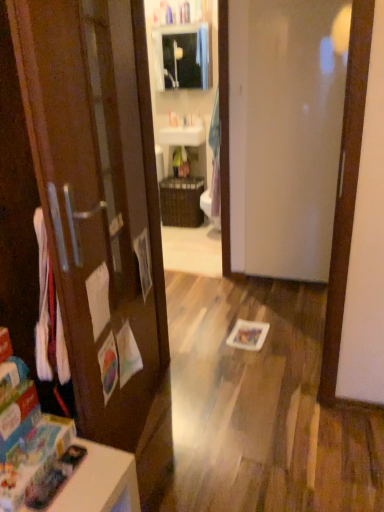
Question: From the image's perspective, is white glossy table at lower left on top of white glossy door at center?

Choices:
 (A) yes
 (B) no

Answer: (B)

Question: From a real-world perspective, does white glossy table at lower left sit lower than white glossy door at center?

Choices:
 (A) no
 (B) yes

Answer: (B)

Question: Does white glossy table at lower left appear on the right side of white glossy door at center?

Choices:
 (A) no
 (B) yes

Answer: (A)

Question: Does white glossy table at lower left turn towards white glossy door at center?

Choices:
 (A) no
 (B) yes

Answer: (A)

Question: From a real-world perspective, is white glossy table at lower left on white glossy door at center?

Choices:
 (A) no
 (B) yes

Answer: (A)

Question: From a real-world perspective, is white plastic sink at upper center above or below matte glass medicine cabinet at upper center?

Choices:
 (A) below
 (B) above

Answer: (A)

Question: In the image, is white plastic sink at upper center on the left side or the right side of matte glass medicine cabinet at upper center?

Choices:
 (A) left
 (B) right

Answer: (A)

Question: Is white plastic sink at upper center inside or outside of matte glass medicine cabinet at upper center?

Choices:
 (A) outside
 (B) inside

Answer: (A)

Question: In terms of height, does white plastic sink at upper center look taller or shorter compared to matte glass medicine cabinet at upper center?

Choices:
 (A) tall
 (B) short

Answer: (B)

Question: In terms of height, does white plastic sink at upper center look taller or shorter compared to white glossy door at center?

Choices:
 (A) tall
 (B) short

Answer: (B)

Question: From a real-world perspective, is white plastic sink at upper center above or below white glossy door at center?

Choices:
 (A) below
 (B) above

Answer: (B)

Question: Considering the positions of point (172, 120) and point (274, 72), is point (172, 120) closer or farther from the camera than point (274, 72)?

Choices:
 (A) closer
 (B) farther

Answer: (B)

Question: From the image's perspective, is white plastic sink at upper center above or below white glossy door at center?

Choices:
 (A) above
 (B) below

Answer: (A)

Question: Considering the positions of white glossy sink at upper center and matte glass medicine cabinet at upper center in the image, is white glossy sink at upper center bigger or smaller than matte glass medicine cabinet at upper center?

Choices:
 (A) big
 (B) small

Answer: (B)

Question: Considering their positions, is white glossy sink at upper center located in front of or behind matte glass medicine cabinet at upper center?

Choices:
 (A) behind
 (B) front

Answer: (A)